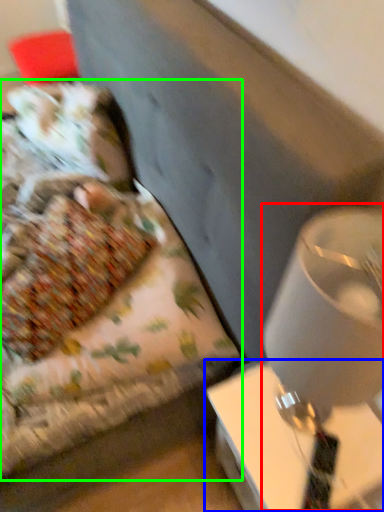
Question: Considering the real-world distances, which object is farthest from table lamp (highlighted by a red box)? table (highlighted by a blue box) or bed (highlighted by a green box)?

Choices:
 (A) table
 (B) bed

Answer: (B)